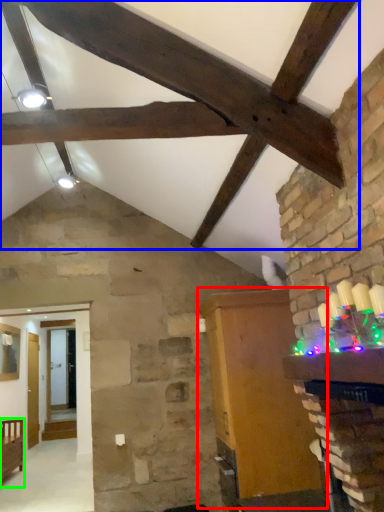
Question: Which is farther away from furniture (highlighted by a red box)? exhaust hood (highlighted by a blue box) or furniture (highlighted by a green box)?

Choices:
 (A) exhaust hood
 (B) furniture

Answer: (B)